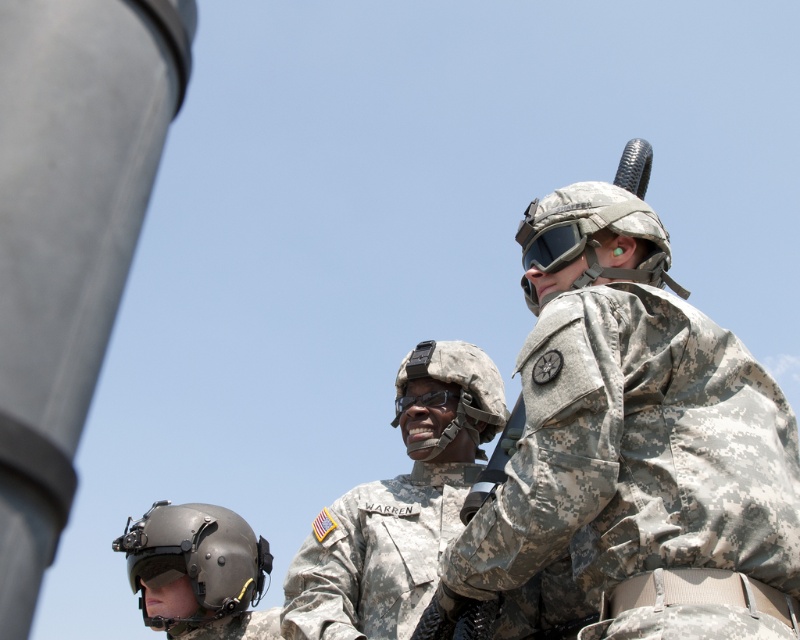
Does camouflage fabric helmet at center lie in front of matte black goggles at upper center?

No, it is not.

Is point (494, 369) in front of point (582, 250)?

No, it is behind (582, 250).

Between point (486, 358) and point (576, 234), which one is positioned behind?

The point (486, 358) is behind.

Where is `camouflage fabric helmet at center`? This screenshot has height=640, width=800. camouflage fabric helmet at center is located at coordinates (458, 392).

Is point (176, 621) positioned after point (529, 253)?

Yes.

Is matte black helmet at lower left positioned in front of matte black goggles at upper center?

No, it is not.

What do you see at coordinates (198, 572) in the screenshot?
I see `matte black helmet at lower left` at bounding box center [198, 572].

Identify the location of matte black helmet at lower left. (198, 572).

Does camouflage fabric uniform at right have a greater width compared to camouflage fabric helmet at center?

Yes, camouflage fabric uniform at right is wider than camouflage fabric helmet at center.

Locate an element on the screen. The image size is (800, 640). camouflage fabric uniform at right is located at coordinates (638, 449).

The height and width of the screenshot is (640, 800). Identify the location of camouflage fabric uniform at right. (638, 449).